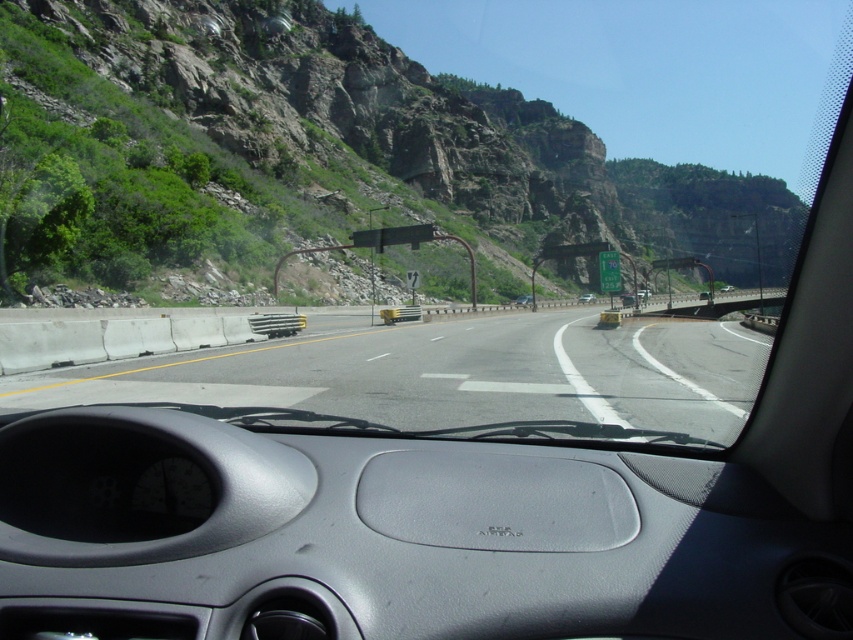
You are driving a car and need to check if your dashboard can fit a GPS device. The GPS device is the size of the silver metallic sedan at center. Can the gray matte dashboard at center accommodate it?

The gray matte dashboard at center is smaller than the silver metallic sedan at center. Therefore, the GPS device, which is the size of the silver metallic sedan at center, cannot fit on the gray matte dashboard at center since it is smaller.

You are a passenger in a car and want to check the dashboard. Where is the gray matte dashboard at center located in the image?

The gray matte dashboard at center is located at point (413, 531) in the image.